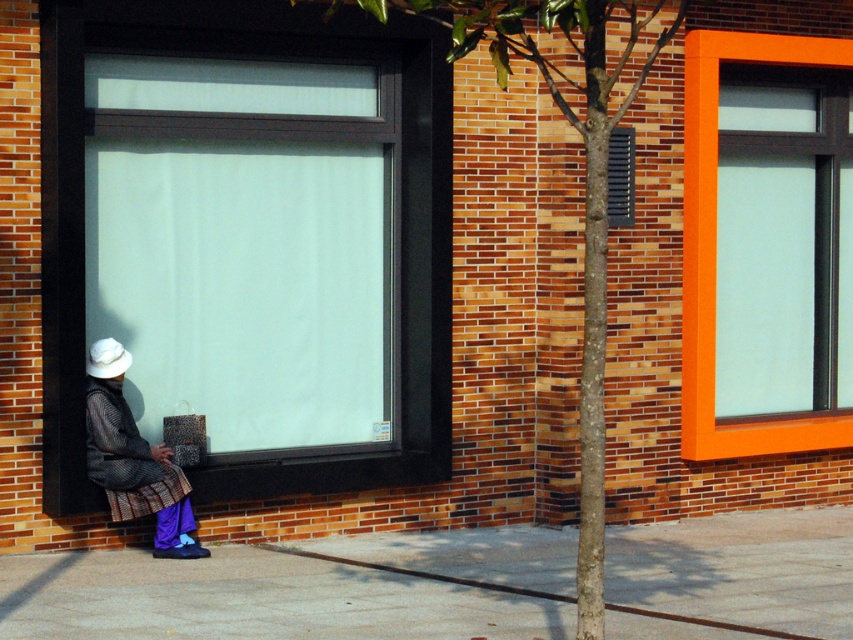
Consider the image. Does smooth bark tree at center have a lesser width compared to matte black coat at lower left?

Yes, smooth bark tree at center is thinner than matte black coat at lower left.

Is smooth bark tree at center positioned behind matte black coat at lower left?

No, smooth bark tree at center is in front of matte black coat at lower left.

This screenshot has width=853, height=640. Describe the element at coordinates (584, 176) in the screenshot. I see `smooth bark tree at center` at that location.

Find the location of a particular element. Image resolution: width=853 pixels, height=640 pixels. smooth bark tree at center is located at coordinates point(584,176).

Who is higher up, matte glass window at center or concrete pavement at lower center?

matte glass window at center

Does matte glass window at center lie in front of concrete pavement at lower center?

No, matte glass window at center is further to the viewer.

Who is more distant from viewer, (444, 296) or (351, 570)?

Point (444, 296)

Where is `matte glass window at center`? The height and width of the screenshot is (640, 853). matte glass window at center is located at coordinates (248, 240).

Is concrete pavement at lower center smaller than smooth bark tree at center?

Incorrect, concrete pavement at lower center is not smaller in size than smooth bark tree at center.

Looking at this image, who is more forward, (711, 564) or (583, 3)?

Point (583, 3) is more forward.

Where is `concrete pavement at lower center`? concrete pavement at lower center is located at coordinates (300, 588).